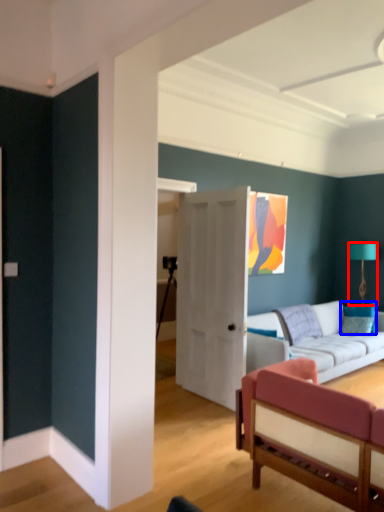
Question: Among these objects, which one is farthest to the camera, lamp (highlighted by a red box) or pillow (highlighted by a blue box)?

Choices:
 (A) lamp
 (B) pillow

Answer: (A)